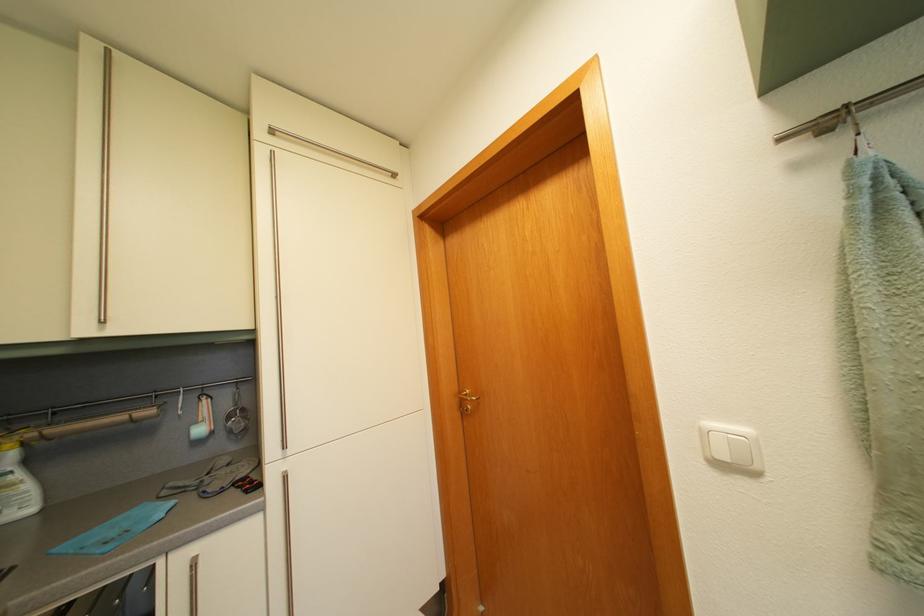
Where is `small metal sieve`? small metal sieve is located at coordinates (237, 416).